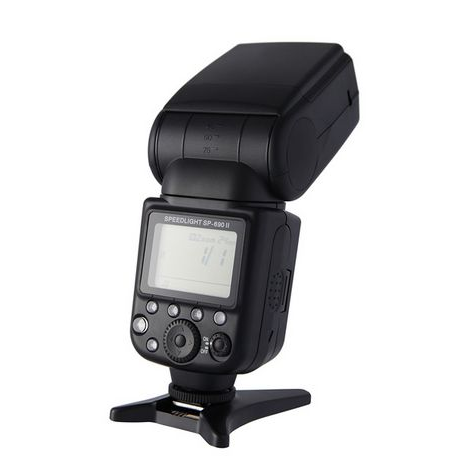
What are the coordinates of `knob` in the screenshot? It's located at (190, 348).